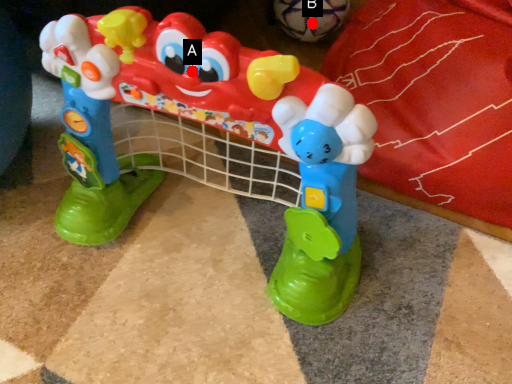
Question: Two points are circled on the image, labeled by A and B beside each circle. Which of the following is the closest to the observer?

Choices:
 (A) A is closer
 (B) B is closer

Answer: (A)